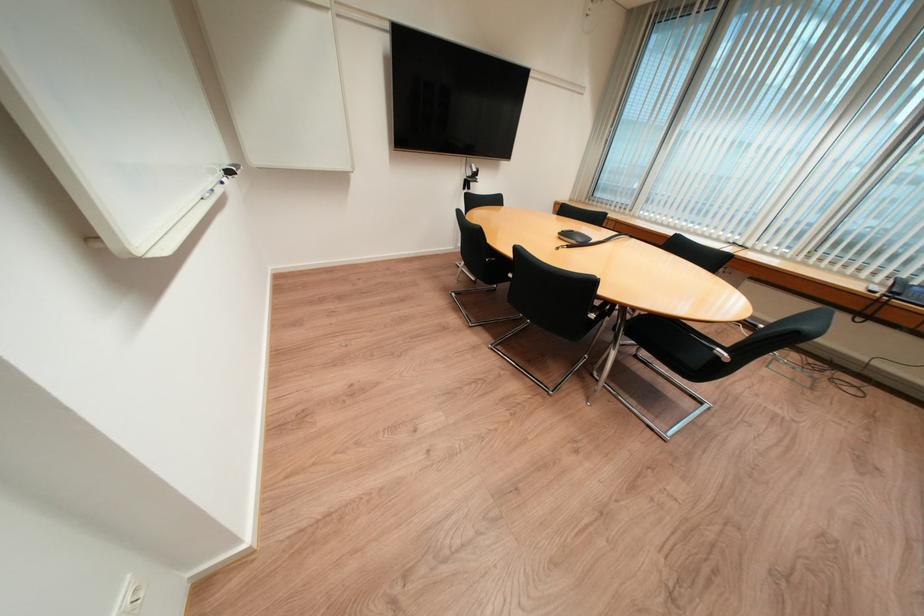
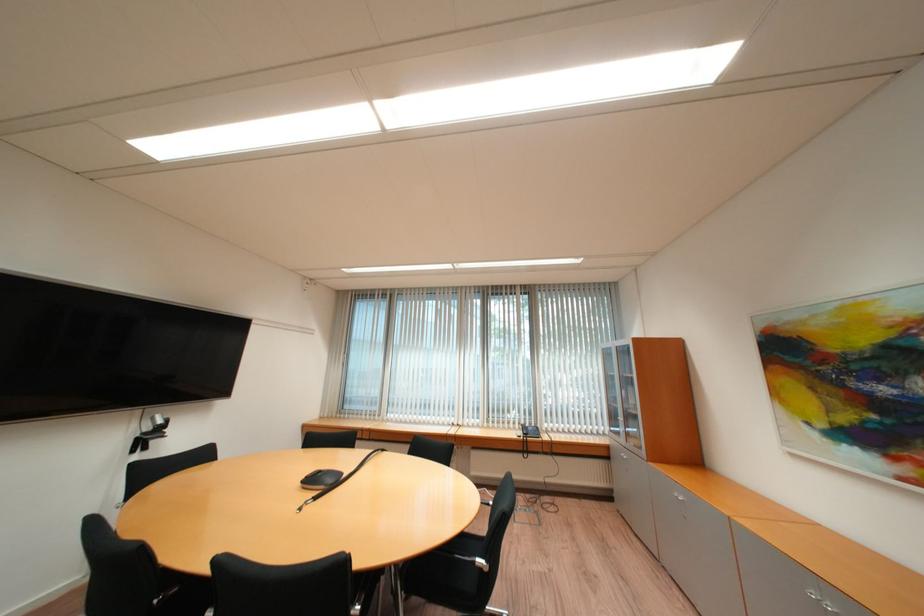
In the second image, find the point that corresponds to point (574, 236) in the first image.

(320, 482)